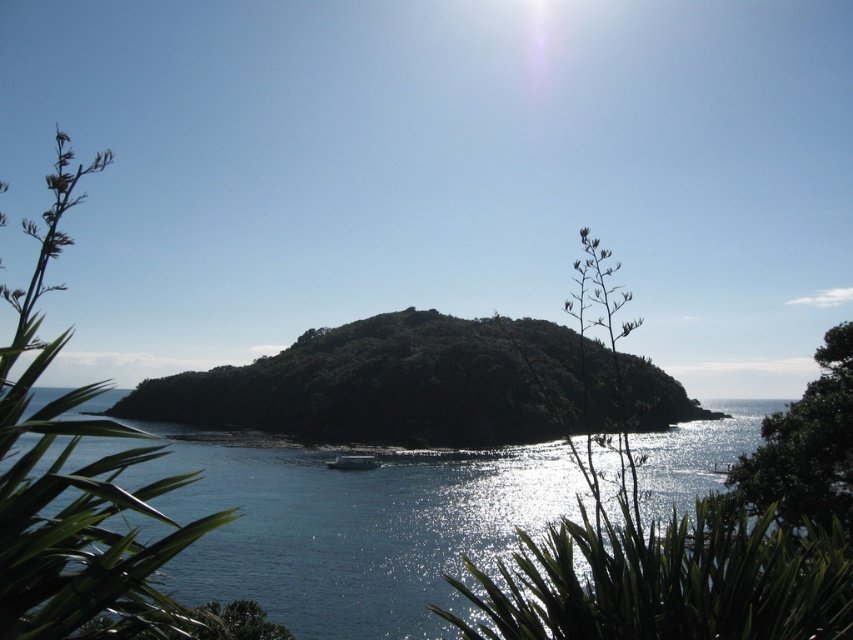
You are standing in front of the coastal scene and want to know which of the green leafy plant at lower center or the green leafy plant at right is taller. Can you tell me?

The green leafy plant at lower center is taller than the green leafy plant at right.

You are a photographer standing on a boat in the middle of the calm blue waters. You want to take a photo of the green leafy island at center and the green leafy plant at lower center. Which object should you focus on first to ensure both are in sharp focus?

You should focus on the green leafy plant at lower center first because it is closer to you than the green leafy island at center, which is further away. By focusing on the closer object, the island will still be within the depth of field and remain sharp.